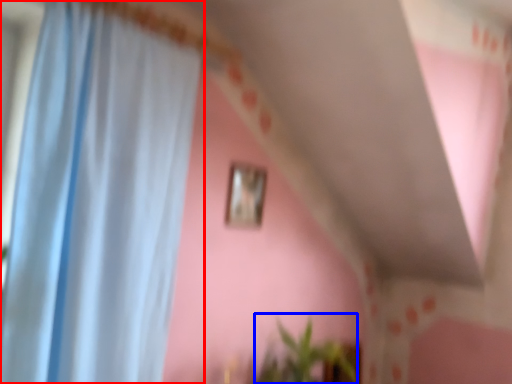
Question: Which of the following is the farthest to the observer, curtain (highlighted by a red box) or plant (highlighted by a blue box)?

Choices:
 (A) curtain
 (B) plant

Answer: (B)